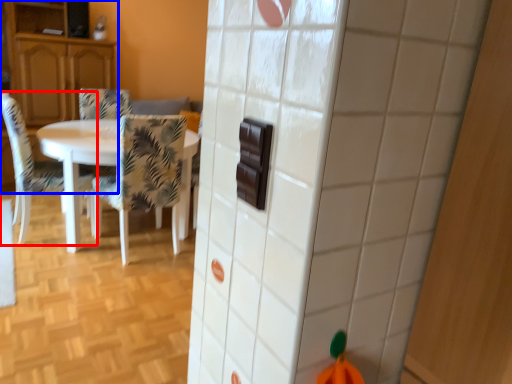
Question: Which object appears closest to the camera in this image, chair (highlighted by a red box) or cabinetry (highlighted by a blue box)?

Choices:
 (A) chair
 (B) cabinetry

Answer: (A)